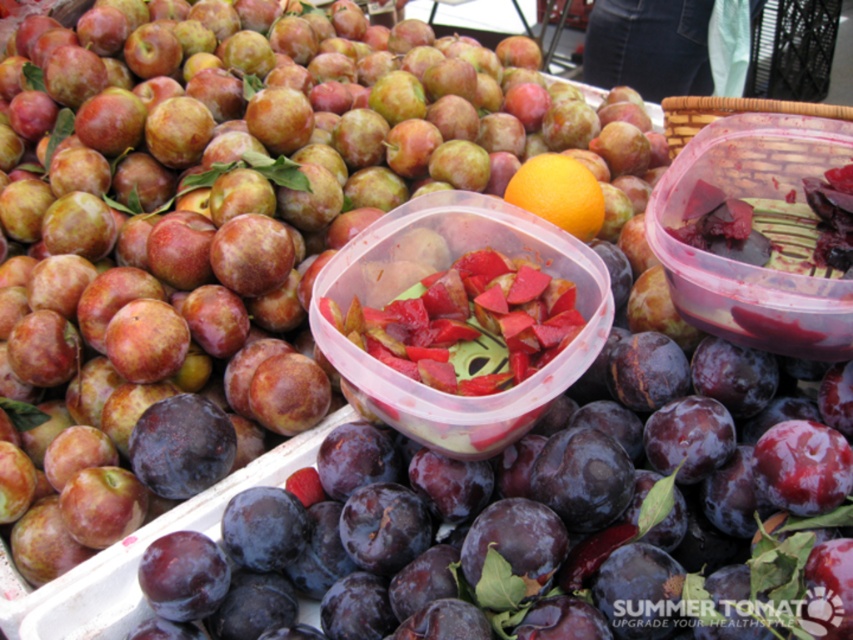
Question: Which object appears farthest from the camera in this image?

Choices:
 (A) orange matte at center
 (B) shiny red apple at upper left

Answer: (A)

Question: Can you confirm if shiny red apple at upper left is smaller than orange matte at center?

Choices:
 (A) yes
 (B) no

Answer: (B)

Question: Is shiny red apple at upper left to the right of orange matte at center from the viewer's perspective?

Choices:
 (A) yes
 (B) no

Answer: (B)

Question: Is the position of shiny red apple at upper left more distant than that of orange matte at center?

Choices:
 (A) yes
 (B) no

Answer: (B)

Question: Among these points, which one is farthest from the camera?

Choices:
 (A) (515, 202)
 (B) (479, 337)

Answer: (A)